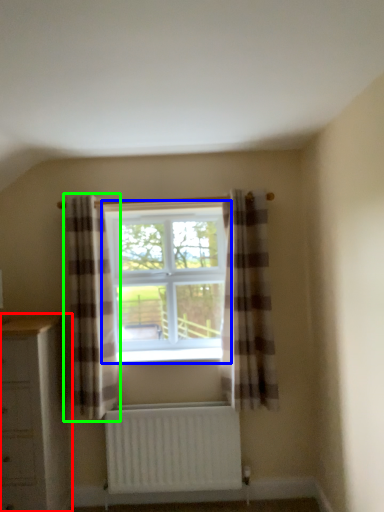
Question: Which object is positioned farthest from chest of drawers (highlighted by a red box)? Select from window (highlighted by a blue box) and curtain (highlighted by a green box).

Choices:
 (A) window
 (B) curtain

Answer: (A)